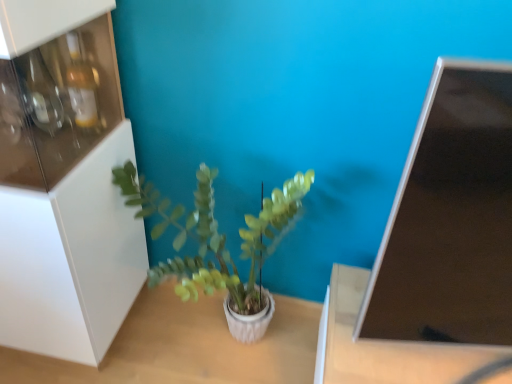
Question: Are matte black monitor at upper right and white textured table at center, which ranks as the first table in left-to-right order, located far from each other?

Choices:
 (A) no
 (B) yes

Answer: (A)

Question: Does matte black monitor at upper right appear on the right side of white textured table at center, which is counted as the 2th table, starting from the right?

Choices:
 (A) no
 (B) yes

Answer: (B)

Question: Considering the relative sizes of matte black monitor at upper right and white textured table at center, which is counted as the 2th table, starting from the right, in the image provided, is matte black monitor at upper right taller than white textured table at center, which is counted as the 2th table, starting from the right,?

Choices:
 (A) no
 (B) yes

Answer: (B)

Question: Can you confirm if matte black monitor at upper right is shorter than white textured table at center, which is counted as the 2th table, starting from the right?

Choices:
 (A) no
 (B) yes

Answer: (A)

Question: Is matte black monitor at upper right wider than white textured table at center, which ranks as the first table in left-to-right order?

Choices:
 (A) yes
 (B) no

Answer: (B)

Question: From the image's perspective, is matte black monitor at upper right over white textured table at center, which ranks as the first table in left-to-right order?

Choices:
 (A) no
 (B) yes

Answer: (B)

Question: Is green matte plant at center with white textured table at center, which ranks as the first table in left-to-right order?

Choices:
 (A) yes
 (B) no

Answer: (B)

Question: Does green matte plant at center lie behind white textured table at center, which is counted as the 2th table, starting from the right?

Choices:
 (A) no
 (B) yes

Answer: (A)

Question: From a real-world perspective, is green matte plant at center positioned under white textured table at center, which ranks as the first table in left-to-right order, based on gravity?

Choices:
 (A) no
 (B) yes

Answer: (A)

Question: Is green matte plant at center outside of white textured table at center, which is counted as the 2th table, starting from the right?

Choices:
 (A) no
 (B) yes

Answer: (B)

Question: Considering the relative sizes of green matte plant at center and white textured table at center, which is counted as the 2th table, starting from the right, in the image provided, is green matte plant at center smaller than white textured table at center, which is counted as the 2th table, starting from the right,?

Choices:
 (A) yes
 (B) no

Answer: (B)

Question: Can you confirm if green matte plant at center is wider than white textured table at center, which is counted as the 2th table, starting from the right?

Choices:
 (A) no
 (B) yes

Answer: (A)

Question: Is brown matte table at lower right, which is the first table in right-to-left order, in contact with matte black monitor at upper right?

Choices:
 (A) no
 (B) yes

Answer: (A)